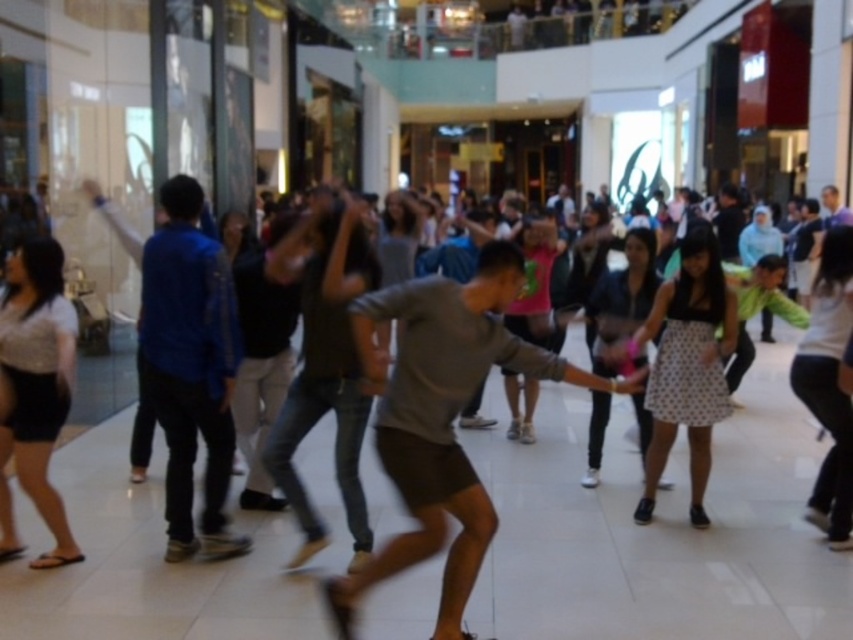
Can you confirm if gray matte shirt at center is thinner than blue cotton shirt at left?

No.

Between point (474, 515) and point (204, 273), which one is positioned behind?

Positioned behind is point (204, 273).

Which is behind, point (440, 342) or point (178, 392)?

Point (178, 392)

Find the location of a particular element. gray matte shirt at center is located at coordinates (440, 419).